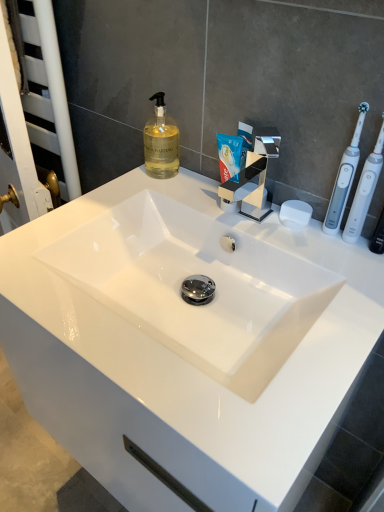
You are a GUI agent. You are given a task and a screenshot of the screen. Output one action in this format:
    pyautogui.click(x=<x>, y=<y>)
    Task: Click on the free space in front of chrome metallic tap at center
    
    Given the screenshot: What is the action you would take?
    pyautogui.click(x=309, y=272)